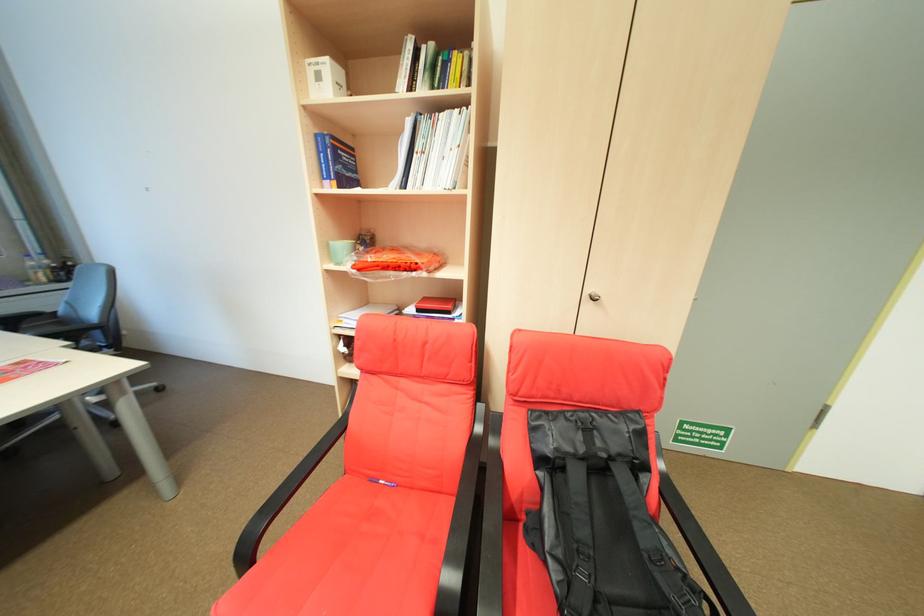
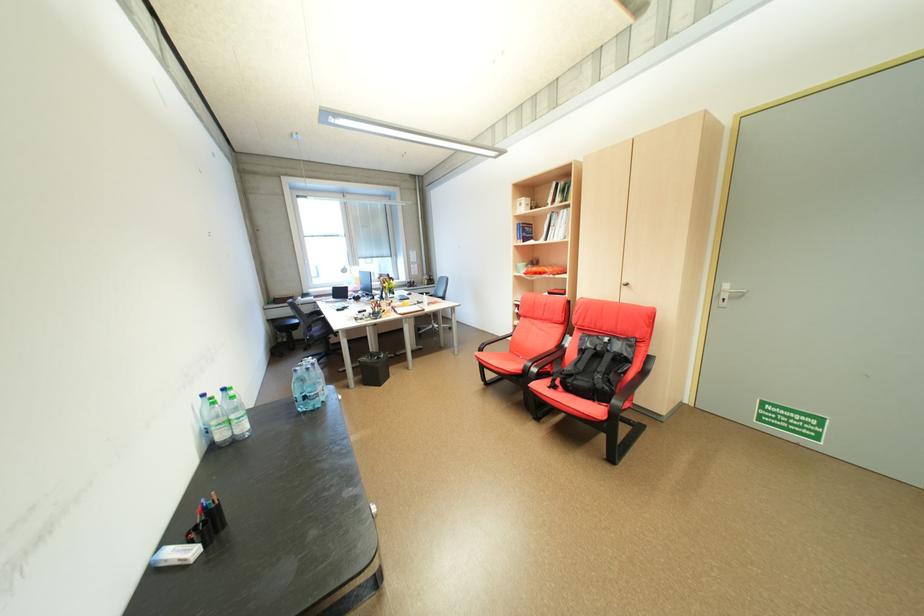
Where in the second image is the point corresponding to point 344,148 from the first image?

(532, 228)